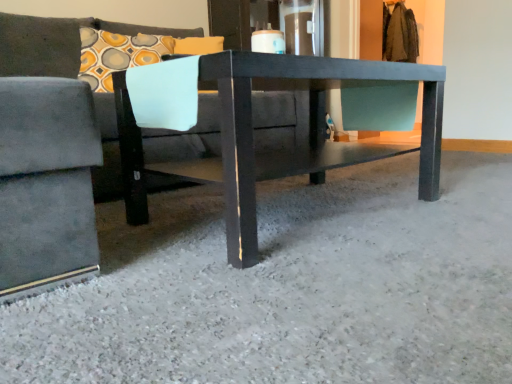
You are a GUI agent. You are given a task and a screenshot of the screen. Output one action in this format:
    pyautogui.click(x=<x>, y=<y>)
    Task: Click on the smooth gray carpet at center
    
    Given the screenshot: What is the action you would take?
    pyautogui.click(x=291, y=287)

Is velvet gray couch at center oriented towards matte black table at center?

Yes.

Who is bigger, velvet gray couch at center or matte black table at center?

velvet gray couch at center.

Consider the image. Is velvet gray couch at center shorter than matte black table at center?

In fact, velvet gray couch at center may be taller than matte black table at center.

Which is closer to the camera, [279,137] or [243,65]?

The point [243,65] is closer.

Is smooth gray carpet at center far away from matte black table at center?

smooth gray carpet at center is actually quite close to matte black table at center.

Which is more to the left, smooth gray carpet at center or matte black table at center?

matte black table at center is more to the left.

Is smooth gray carpet at center thinner than matte black table at center?

In fact, smooth gray carpet at center might be wider than matte black table at center.

Looking at this image, from a real-world perspective, which is physically below, smooth gray carpet at center or matte black table at center?

smooth gray carpet at center.

Between matte black table at center and velvet gray couch at center, which one has more height?

velvet gray couch at center is taller.

Looking at this image, from the image's perspective, which one is positioned higher, matte black table at center or velvet gray couch at center?

velvet gray couch at center.

How different are the orientations of matte black table at center and velvet gray couch at center in degrees?

The angle between the facing direction of matte black table at center and the facing direction of velvet gray couch at center is 1.49 degrees.

Which is in front, point (226, 127) or point (79, 40)?

The point (226, 127) is in front.

Locate an element on the screen. concrete that is in front of the velvet gray couch at center is located at coordinates (291, 287).

Considering the relative sizes of velvet gray couch at center and smooth gray carpet at center in the image provided, is velvet gray couch at center taller than smooth gray carpet at center?

Indeed, velvet gray couch at center has a greater height compared to smooth gray carpet at center.

Based on the photo, from a real-world perspective, is velvet gray couch at center positioned over smooth gray carpet at center based on gravity?

Correct, in the physical world, velvet gray couch at center is higher than smooth gray carpet at center.

This screenshot has height=384, width=512. What are the coordinates of `concrete below the matte black table at center (from the image's perspective)` in the screenshot? It's located at (291, 287).

Is matte black table at center positioned with its back to smooth gray carpet at center?

That's not correct — matte black table at center is not looking away from smooth gray carpet at center.

From a real-world perspective, which object rests below the other?

smooth gray carpet at center.

How far apart are matte black table at center and smooth gray carpet at center?

matte black table at center and smooth gray carpet at center are 10.37 inches apart from each other.

Would you say smooth gray carpet at center is outside velvet gray couch at center?

Yes, smooth gray carpet at center is outside of velvet gray couch at center.

Looking at this image, is smooth gray carpet at center at the left side of velvet gray couch at center?

Incorrect, smooth gray carpet at center is not on the left side of velvet gray couch at center.

Where is `studio couch on the left of smooth gray carpet at center`? The image size is (512, 384). studio couch on the left of smooth gray carpet at center is located at coordinates (57, 156).

Consider the image. Which is farther, (298, 348) or (61, 26)?

Positioned behind is point (61, 26).

The height and width of the screenshot is (384, 512). Find the location of `studio couch that is above the matte black table at center (from a real-world perspective)`. studio couch that is above the matte black table at center (from a real-world perspective) is located at coordinates coord(57,156).

The width and height of the screenshot is (512, 384). I want to click on table on the left of smooth gray carpet at center, so click(x=276, y=151).

Which object lies nearer to the anchor point velvet gray couch at center, matte black table at center or smooth gray carpet at center?

matte black table at center is closer to velvet gray couch at center.

Which object lies nearer to the anchor point smooth gray carpet at center, velvet gray couch at center or matte black table at center?

Among the two, matte black table at center is located nearer to smooth gray carpet at center.

Based on their spatial positions, is velvet gray couch at center or smooth gray carpet at center closer to matte black table at center?

Based on the image, smooth gray carpet at center appears to be nearer to matte black table at center.

When comparing their distances from velvet gray couch at center, does smooth gray carpet at center or matte black table at center seem closer?

matte black table at center.

Based on their spatial positions, is matte black table at center or velvet gray couch at center closer to smooth gray carpet at center?

matte black table at center is positioned closer to the anchor smooth gray carpet at center.

Considering their positions, is smooth gray carpet at center positioned further to matte black table at center than velvet gray couch at center?

Based on the image, velvet gray couch at center appears to be further to matte black table at center.

The width and height of the screenshot is (512, 384). Identify the location of table between velvet gray couch at center and smooth gray carpet at center in the horizontal direction. (276, 151).